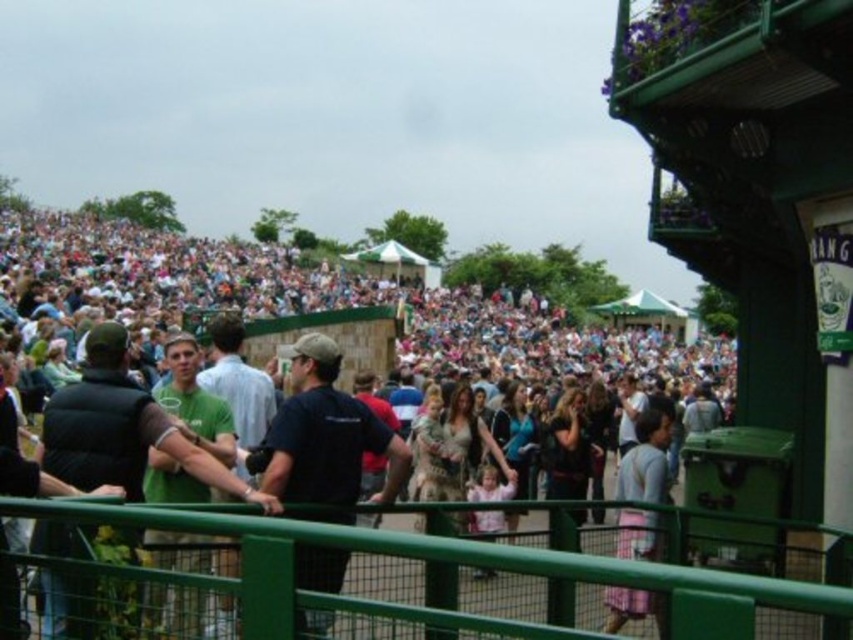
You are a photographer at the event and want to capture a photo that includes both the green fabric jacket at left and the pink fabric dress at center. However, you need to ensure that neither object is blocked by another. Can you take the photo from your current position without moving? Please explain.

The green fabric jacket at left is positioned over the pink fabric dress at center, so taking a photo from your current position would result in the green fabric jacket at left blocking the pink fabric dress at center. Therefore, you cannot take the photo without moving to a different angle where both are visible without obstruction.